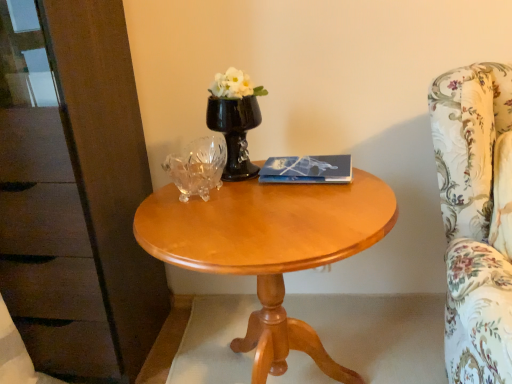
This screenshot has height=384, width=512. What do you see at coordinates (307, 169) in the screenshot?
I see `blue glossy book at center` at bounding box center [307, 169].

The height and width of the screenshot is (384, 512). Describe the element at coordinates (234, 132) in the screenshot. I see `black glass vase at center` at that location.

Locate an element on the screen. matte brown dresser at left is located at coordinates (75, 192).

Is glossy wood table at center looking in the opposite direction of matte brown dresser at left?

No, glossy wood table at center's orientation is not away from matte brown dresser at left.

Can you confirm if glossy wood table at center is wider than matte brown dresser at left?

Yes.

Which of these two, glossy wood table at center or matte brown dresser at left, stands taller?

matte brown dresser at left is taller.

Who is more distant, glossy wood table at center or matte brown dresser at left?

matte brown dresser at left is further from the camera.

Does blue glossy book at center have a greater height compared to floral fabric armchair at right?

In fact, blue glossy book at center may be shorter than floral fabric armchair at right.

Considering the positions of objects blue glossy book at center and floral fabric armchair at right in the image provided, who is more to the right, blue glossy book at center or floral fabric armchair at right?

floral fabric armchair at right.

Based on the photo, from the image's perspective, relative to floral fabric armchair at right, is blue glossy book at center above or below?

Clearly, from the image's perspective, blue glossy book at center is above floral fabric armchair at right.

Does blue glossy book at center have a lesser width compared to floral fabric armchair at right?

Indeed, blue glossy book at center has a lesser width compared to floral fabric armchair at right.

Can you see black glass vase at center touching glossy wood table at center?

No, black glass vase at center is not touching glossy wood table at center.

Based on the photo, how much distance is there between black glass vase at center and glossy wood table at center?

11.04 inches.

Considering the sizes of black glass vase at center and glossy wood table at center in the image, is black glass vase at center bigger or smaller than glossy wood table at center?

Clearly, black glass vase at center is smaller in size than glossy wood table at center.

Is black glass vase at center aimed at glossy wood table at center?

No, black glass vase at center is not aimed at glossy wood table at center.

Considering the relative positions of floral fabric armchair at right and matte brown dresser at left in the image provided, is floral fabric armchair at right to the left or to the right of matte brown dresser at left?

From the image, it's evident that floral fabric armchair at right is to the right of matte brown dresser at left.

You are a GUI agent. You are given a task and a screenshot of the screen. Output one action in this format:
    pyautogui.click(x=<x>, y=<y>)
    Task: Click on the chair on the right of matte brown dresser at left
    Image resolution: width=512 pixels, height=384 pixels.
    Given the screenshot: What is the action you would take?
    pyautogui.click(x=473, y=219)

Is point (458, 151) positioned in front of point (55, 47)?

Yes, it is.

Does floral fabric armchair at right have a lesser height compared to blue glossy book at center?

Incorrect, the height of floral fabric armchair at right does not fall short of that of blue glossy book at center.

Does floral fabric armchair at right have a smaller size compared to blue glossy book at center?

No, floral fabric armchair at right is not smaller than blue glossy book at center.

From the image's perspective, between floral fabric armchair at right and blue glossy book at center, who is located below?

floral fabric armchair at right is shown below in the image.

In the scene shown: Can matte brown dresser at left be found inside blue glossy book at center?

No.

Could you tell me if blue glossy book at center is turned towards matte brown dresser at left?

No, blue glossy book at center is not oriented towards matte brown dresser at left.

Considering the positions of points (321, 156) and (72, 76), is point (321, 156) farther from camera compared to point (72, 76)?

Yes.

Between blue glossy book at center and matte brown dresser at left, which one has larger size?

With larger size is matte brown dresser at left.

How different are the orientations of glossy wood table at center and floral fabric armchair at right in degrees?

The angle between the facing direction of glossy wood table at center and the facing direction of floral fabric armchair at right is 7.79 degrees.

Considering the relative sizes of glossy wood table at center and floral fabric armchair at right in the image provided, is glossy wood table at center smaller than floral fabric armchair at right?

No.

I want to click on chair above the glossy wood table at center (from the image's perspective), so click(x=473, y=219).

Does glossy wood table at center turn towards floral fabric armchair at right?

No, glossy wood table at center is not oriented towards floral fabric armchair at right.

Image resolution: width=512 pixels, height=384 pixels. What are the coordinates of `desk that is in front of the matte brown dresser at left` in the screenshot? It's located at (270, 249).

The width and height of the screenshot is (512, 384). I want to click on book behind the floral fabric armchair at right, so click(x=307, y=169).

Which object lies further to the anchor point floral fabric armchair at right, blue glossy book at center or matte brown dresser at left?

matte brown dresser at left is further to floral fabric armchair at right.

Based on their spatial positions, is black glass vase at center or blue glossy book at center further from floral fabric armchair at right?

black glass vase at center is further to floral fabric armchair at right.

When comparing their distances from matte brown dresser at left, does floral fabric armchair at right or glossy wood table at center seem closer?

Based on the image, glossy wood table at center appears to be nearer to matte brown dresser at left.

Based on their spatial positions, is black glass vase at center or floral fabric armchair at right further from matte brown dresser at left?

floral fabric armchair at right is positioned further to the anchor matte brown dresser at left.

Which object lies nearer to the anchor point black glass vase at center, blue glossy book at center or glossy wood table at center?

blue glossy book at center is closer to black glass vase at center.

From the image, which object appears to be farther from matte brown dresser at left, black glass vase at center or blue glossy book at center?

blue glossy book at center is further to matte brown dresser at left.

Based on their spatial positions, is matte brown dresser at left or blue glossy book at center further from glossy wood table at center?

The object further to glossy wood table at center is matte brown dresser at left.

Based on their spatial positions, is floral fabric armchair at right or glossy wood table at center closer to black glass vase at center?

glossy wood table at center lies closer to black glass vase at center than the other object.

At what (x,y) coordinates should I click in order to perform the action: click on desk between matte brown dresser at left and floral fabric armchair at right in the horizontal direction. Please return your answer as a coordinate pair (x, y). Looking at the image, I should click on (270, 249).

Find the location of a particular element. book between black glass vase at center and glossy wood table at center in the vertical direction is located at coordinates (307, 169).

The height and width of the screenshot is (384, 512). In order to click on desk between matte brown dresser at left and blue glossy book at center in the horizontal direction in this screenshot , I will do `click(270, 249)`.

What are the coordinates of `desk between black glass vase at center and floral fabric armchair at right from left to right` in the screenshot? It's located at (270, 249).